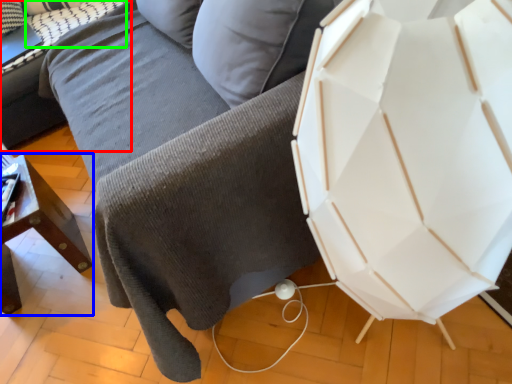
Question: Which object is the closest to the table (highlighted by a red box)? Choose among these: furniture (highlighted by a blue box) or pillow (highlighted by a green box).

Choices:
 (A) furniture
 (B) pillow

Answer: (B)